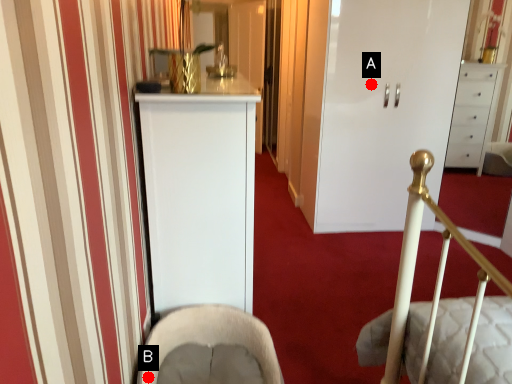
Question: Two points are circled on the image, labeled by A and B beside each circle. Which point is further to the camera?

Choices:
 (A) A is further
 (B) B is further

Answer: (A)